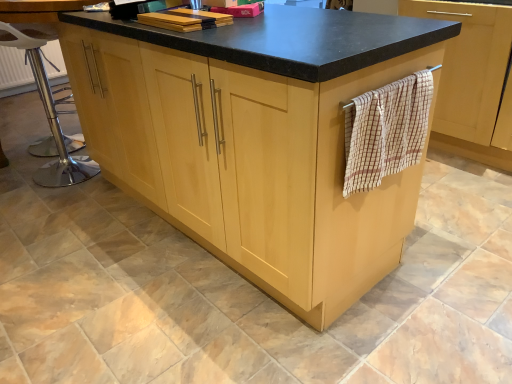
I want to click on vacant area that is in front of polished chrome bar stool at left, so click(47, 201).